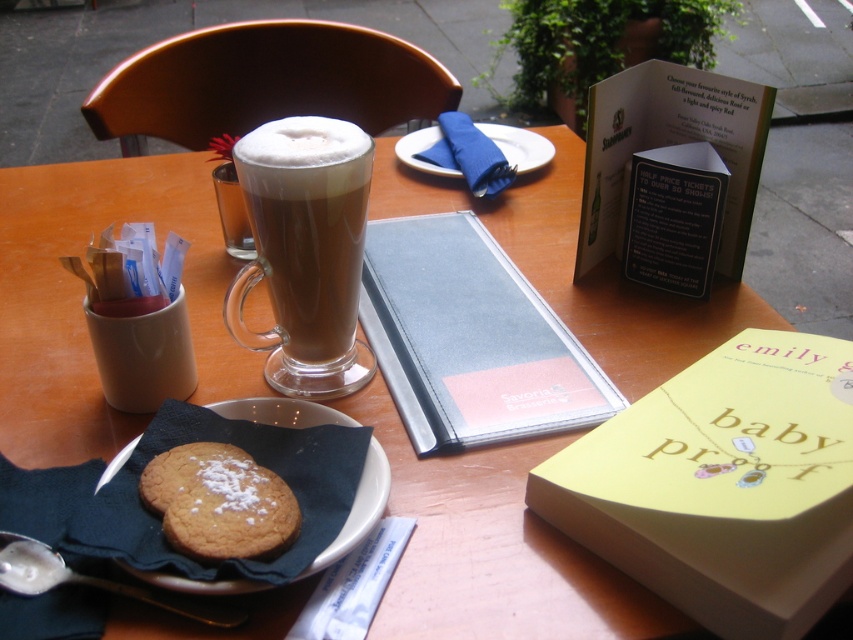
What do you see at coordinates (469, 339) in the screenshot?
I see `blue leather menu at center` at bounding box center [469, 339].

Which of these two, blue leather menu at center or white ceramic saucer at lower left, stands taller?

With more height is blue leather menu at center.

What do you see at coordinates (469, 339) in the screenshot?
I see `blue leather menu at center` at bounding box center [469, 339].

Where is `blue leather menu at center`? This screenshot has width=853, height=640. blue leather menu at center is located at coordinates (469, 339).

Does yellow paperback book at center appear under powdered sugar cookie at center?

Incorrect, yellow paperback book at center is not positioned below powdered sugar cookie at center.

Is point (747, 376) more distant than point (235, 492)?

Yes, point (747, 376) is farther from viewer.

Where is `yellow paperback book at center`? yellow paperback book at center is located at coordinates (723, 484).

Is yellow paperback book at center above sugar-coated cookie at lower left?

Yes, yellow paperback book at center is above sugar-coated cookie at lower left.

Does yellow paperback book at center have a larger size compared to sugar-coated cookie at lower left?

Yes, yellow paperback book at center is bigger than sugar-coated cookie at lower left.

Where is `yellow paperback book at center`? The height and width of the screenshot is (640, 853). yellow paperback book at center is located at coordinates coord(723,484).